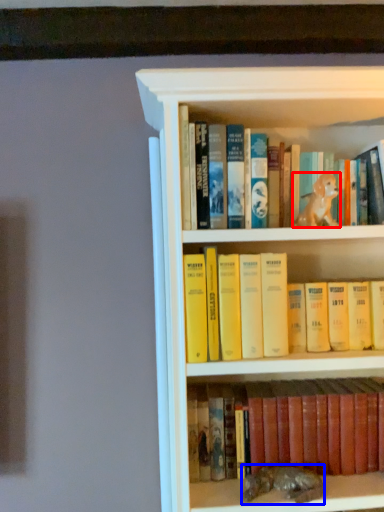
Question: Which point is further to the camera, animal (highlighted by a red box) or animal (highlighted by a blue box)?

Choices:
 (A) animal
 (B) animal

Answer: (B)